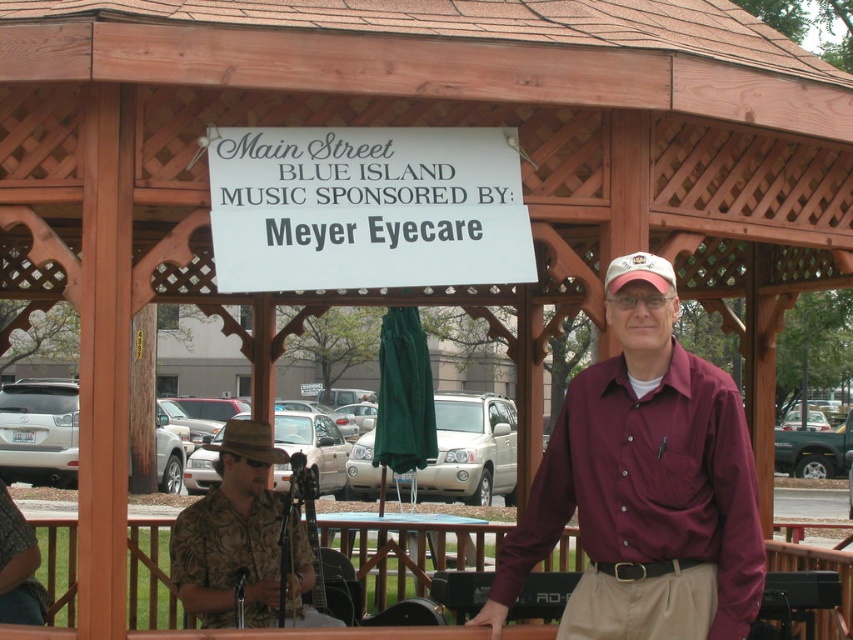
Question: Which of these objects is positioned closest to the brown fabric baseball hat at center?

Choices:
 (A) camouflage shirt at center
 (B) maroon shirt at center
 (C) white fabric baseball cap at upper center

Answer: (A)

Question: Where is white paper sign at center located in relation to white fabric baseball cap at upper center in the image?

Choices:
 (A) left
 (B) right

Answer: (A)

Question: Which point is farther to the camera?

Choices:
 (A) (242, 444)
 (B) (614, 259)
 (C) (706, 465)

Answer: (A)

Question: In this image, where is white paper sign at center located relative to white fabric baseball cap at upper center?

Choices:
 (A) right
 (B) left

Answer: (B)

Question: Which object appears farthest from the camera in this image?

Choices:
 (A) maroon shirt at center
 (B) white paper sign at center
 (C) white fabric baseball cap at upper center

Answer: (C)

Question: Is white paper sign at center thinner than camouflage shirt at center?

Choices:
 (A) yes
 (B) no

Answer: (B)